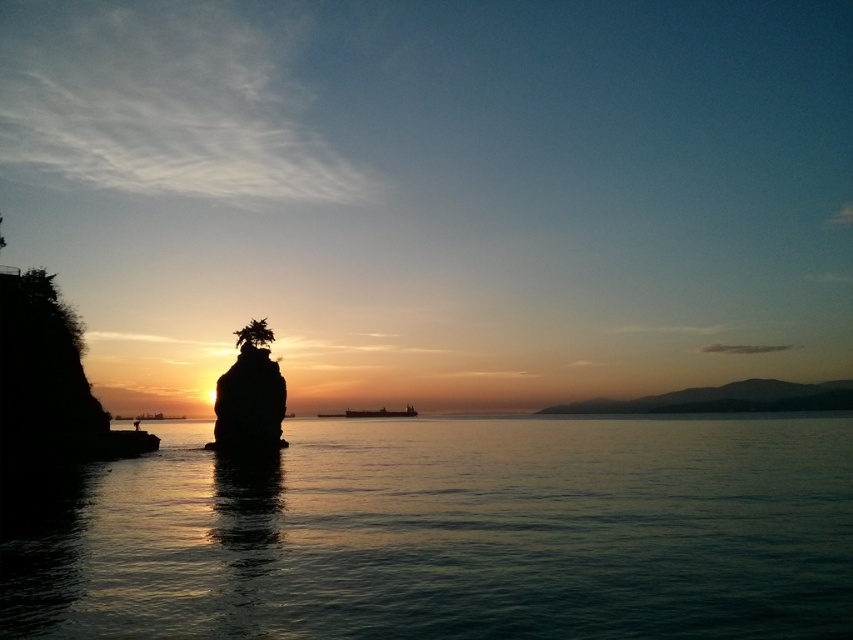
You are standing on the shore looking at the sunset scene. Which object, the transparent water at center or the silhouette stone at center, is closer to you?

The transparent water at center is closer to you because it is in front of the silhouette stone at center.

You are standing at the edge of the water and see two points on the water surface. The first point is labeled as point (265, 429) and the second point is labeled as point (364, 412). Which point is closer to you?

Point (265, 429) is in front of point (364, 412), so it is closer to you.